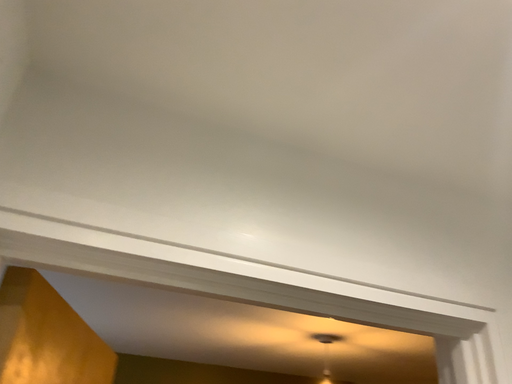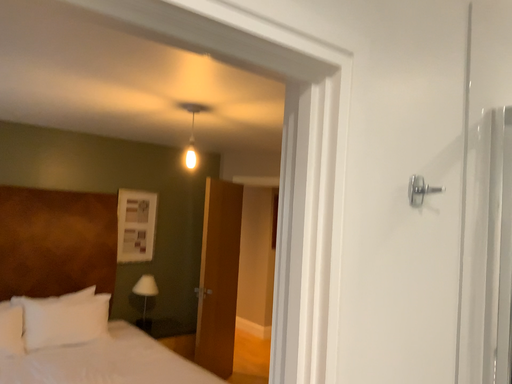
Question: How did the camera likely rotate when shooting the video?

Choices:
 (A) rotated left
 (B) rotated right

Answer: (B)